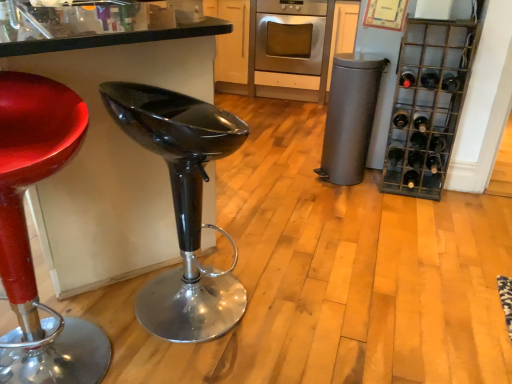
You are a GUI agent. You are given a task and a screenshot of the screen. Output one action in this format:
    pyautogui.click(x=<x>, y=<y>)
    Task: Click on the free space that is in between glossy black stool at center and metallic wine rack at right
    This screenshot has height=384, width=512.
    Given the screenshot: What is the action you would take?
    pyautogui.click(x=328, y=241)